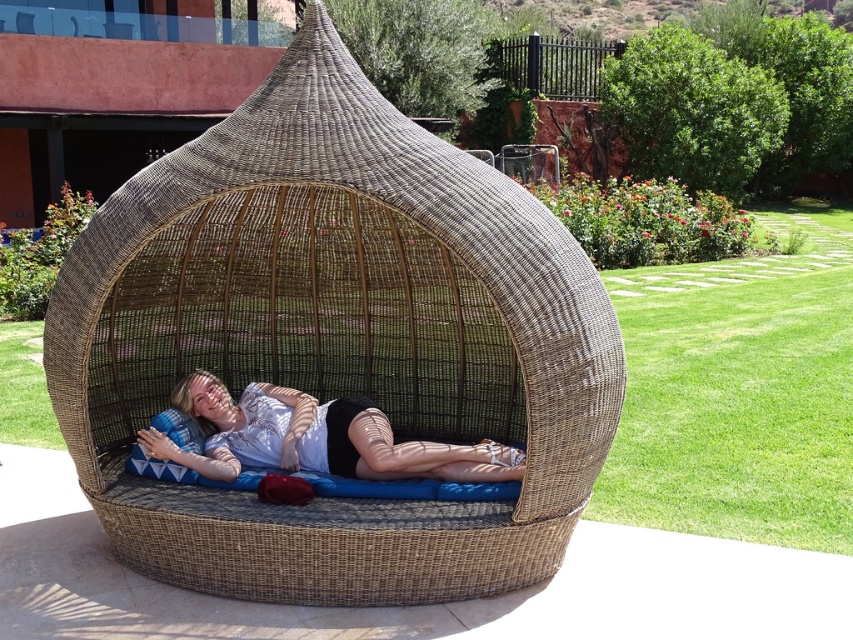
Question: Can you confirm if woven rattan basket at center is wider than matte white shirt at center?

Choices:
 (A) yes
 (B) no

Answer: (A)

Question: Does woven rattan basket at center come in front of matte white shirt at center?

Choices:
 (A) yes
 (B) no

Answer: (A)

Question: Where is woven rattan basket at center located in relation to matte white shirt at center in the image?

Choices:
 (A) below
 (B) above

Answer: (B)

Question: Which point is farther to the camera?

Choices:
 (A) woven rattan basket at center
 (B) matte white shirt at center

Answer: (B)

Question: Which object appears closest to the camera in this image?

Choices:
 (A) matte white shirt at center
 (B) woven rattan basket at center

Answer: (B)